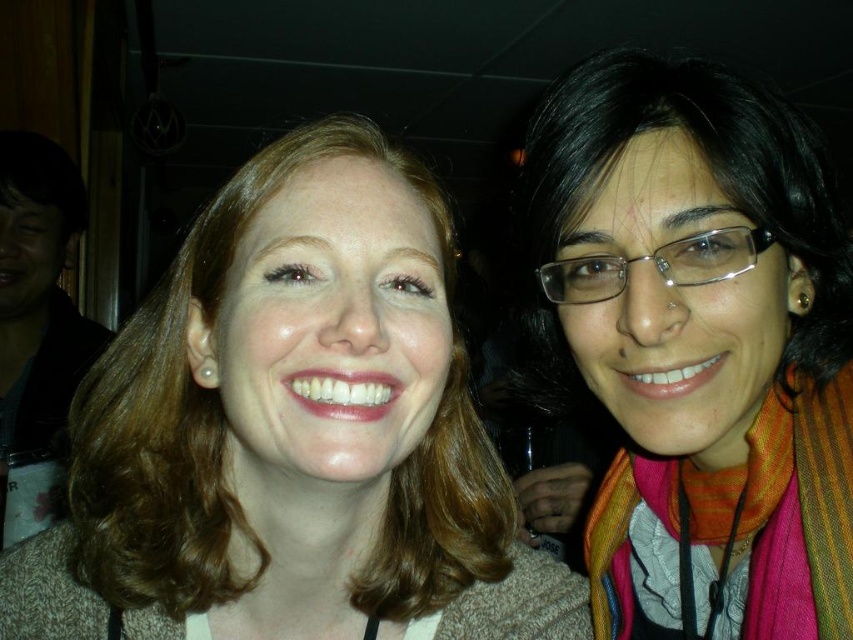
Question: Which object appears farthest from the camera in this image?

Choices:
 (A) multicolored scarf at right
 (B) multicolored woven scarf at right

Answer: (B)

Question: Can you confirm if matte brown hair at center is positioned to the right of multicolored scarf at right?

Choices:
 (A) yes
 (B) no

Answer: (B)

Question: Estimate the real-world distances between objects in this image. Which object is closer to the multicolored scarf at right?

Choices:
 (A) matte brown hair at center
 (B) multicolored woven scarf at right

Answer: (B)

Question: Based on their relative distances, which object is farther from the multicolored woven scarf at right?

Choices:
 (A) multicolored scarf at right
 (B) matte brown hair at center

Answer: (B)

Question: Is matte brown hair at center below multicolored scarf at right?

Choices:
 (A) yes
 (B) no

Answer: (A)

Question: Does multicolored scarf at right have a larger size compared to multicolored woven scarf at right?

Choices:
 (A) yes
 (B) no

Answer: (A)